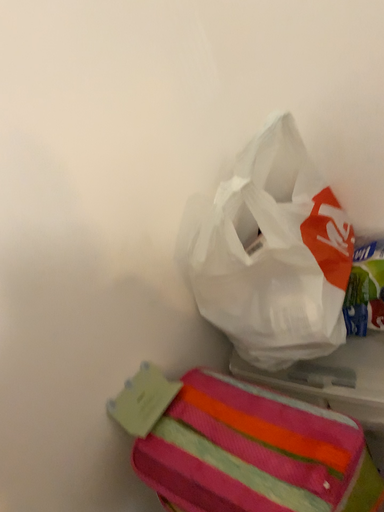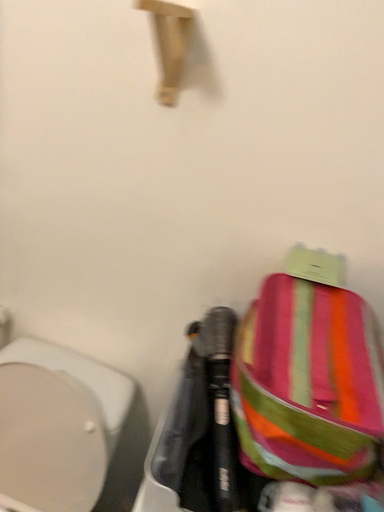
Question: How did the camera likely rotate when shooting the video?

Choices:
 (A) rotated upward
 (B) rotated downward

Answer: (A)